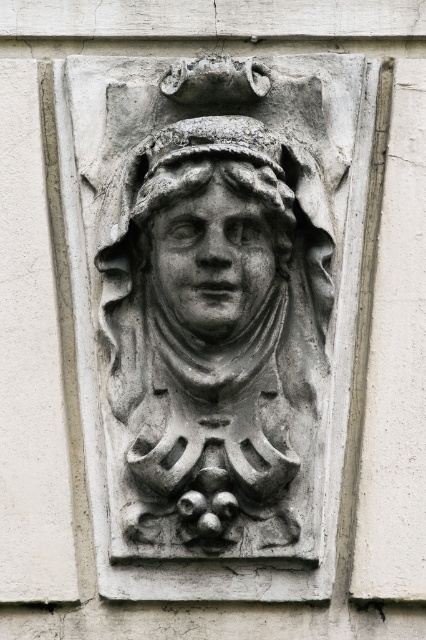
Question: In this image, where is gray stone carving at center located relative to gray stone face at center?

Choices:
 (A) below
 (B) above

Answer: (A)

Question: Does gray stone carving at center appear under gray stone face at center?

Choices:
 (A) yes
 (B) no

Answer: (A)

Question: Among these objects, which one is nearest to the camera?

Choices:
 (A) gray stone carving at center
 (B) gray stone face at center

Answer: (A)

Question: Is the position of gray stone carving at center less distant than that of gray stone face at center?

Choices:
 (A) no
 (B) yes

Answer: (B)

Question: Which object is closer to the camera taking this photo?

Choices:
 (A) gray stone carving at center
 (B) gray stone face at center

Answer: (A)

Question: Among these objects, which one is nearest to the camera?

Choices:
 (A) gray stone face at center
 (B) gray stone carving at center

Answer: (B)